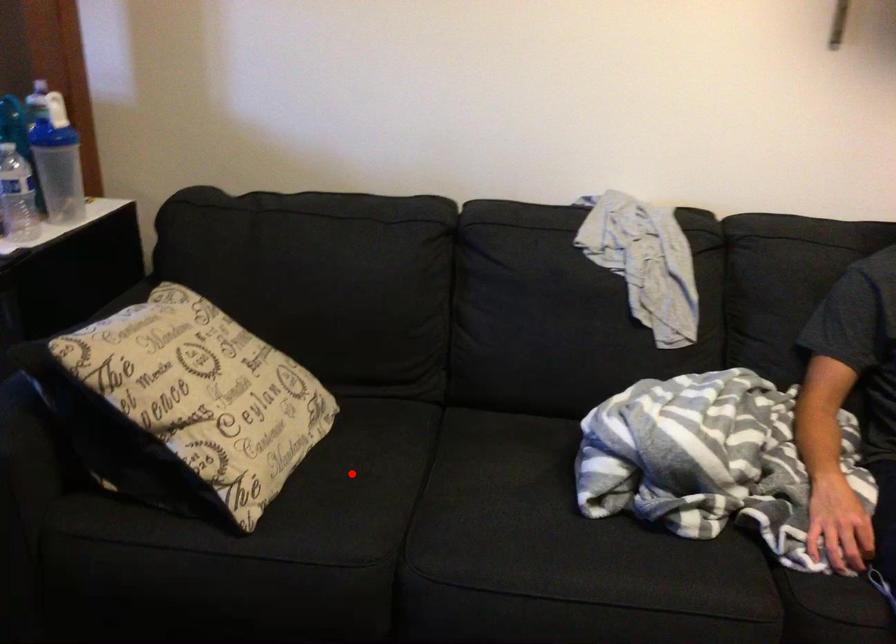
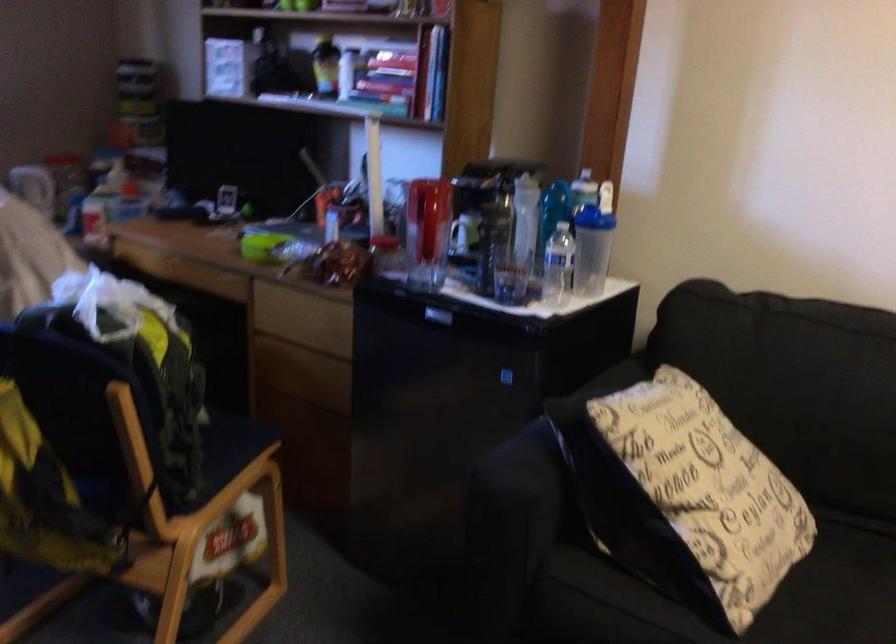
Find the pixel in the second image that matches the highlighted location in the first image.

(842, 603)